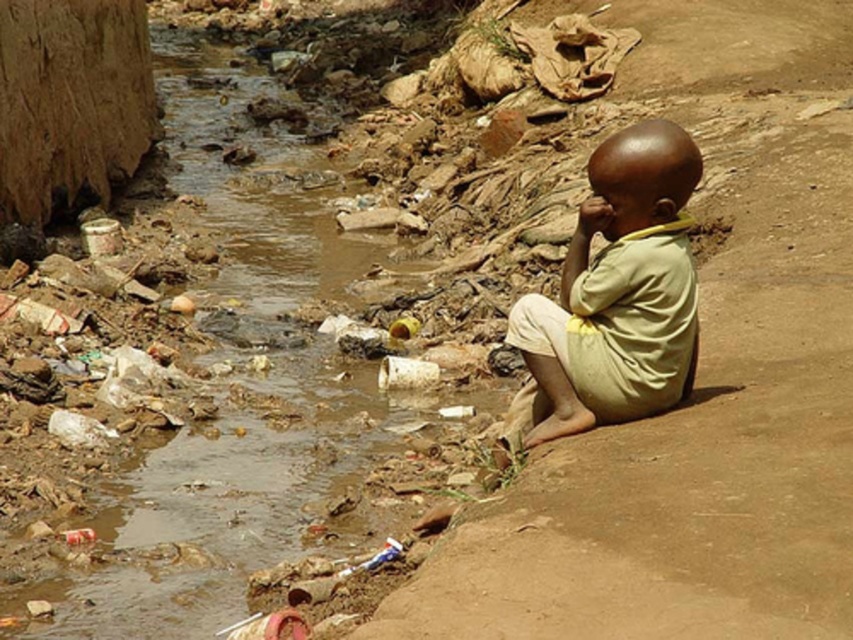
Question: Which of the following is the closest to the observer?

Choices:
 (A) light yellow fabric at right
 (B) brown dirt stream at lower left

Answer: (A)

Question: Does brown dirt stream at lower left have a larger size compared to light yellow fabric at right?

Choices:
 (A) no
 (B) yes

Answer: (B)

Question: Is brown dirt stream at lower left above light yellow fabric at right?

Choices:
 (A) no
 (B) yes

Answer: (B)

Question: Which of the following is the farthest from the observer?

Choices:
 (A) light yellow fabric at right
 (B) brown dirt stream at lower left

Answer: (B)

Question: Is brown dirt stream at lower left further to camera compared to light yellow fabric at right?

Choices:
 (A) no
 (B) yes

Answer: (B)

Question: Which object is closer to the camera taking this photo?

Choices:
 (A) brown dirt stream at lower left
 (B) light yellow fabric at right

Answer: (B)